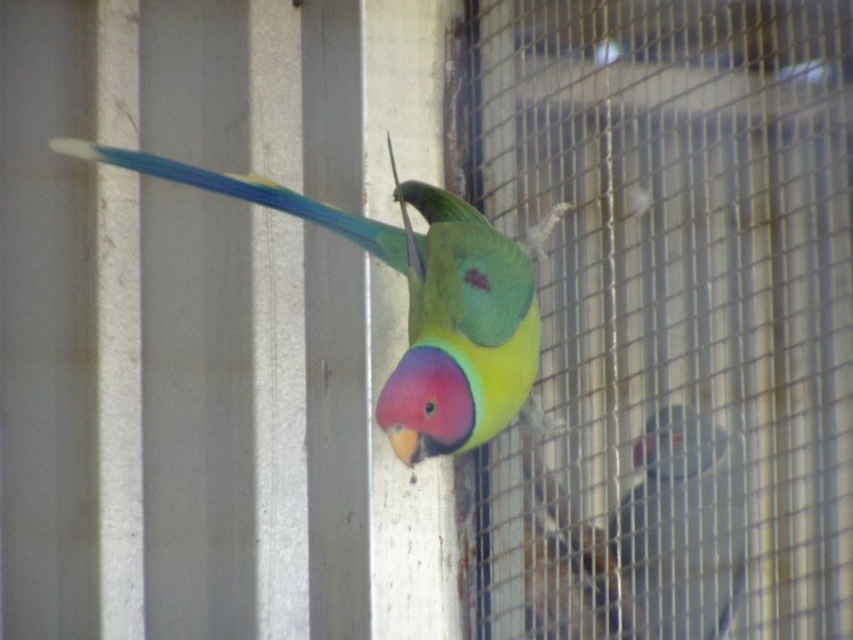
Does shiny green parrot at center have a greater width compared to multicolored feathered parrot at center?

Yes, shiny green parrot at center is wider than multicolored feathered parrot at center.

Is point (390, 252) less distant than point (660, 429)?

That is False.

What do you see at coordinates (415, 301) in the screenshot?
I see `shiny green parrot at center` at bounding box center [415, 301].

Image resolution: width=853 pixels, height=640 pixels. I want to click on shiny green parrot at center, so pyautogui.click(x=415, y=301).